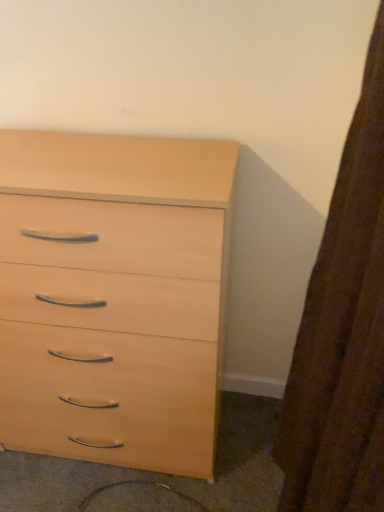
Where is `free space above light wood drawer at lower center (from a real-world perspective)`? free space above light wood drawer at lower center (from a real-world perspective) is located at coordinates (177, 475).